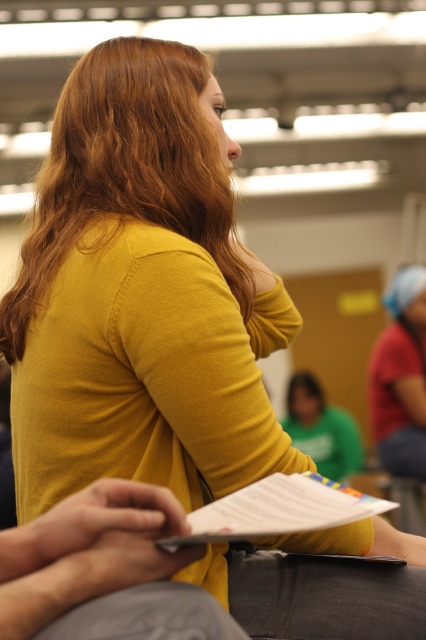
Question: Which object is closer to the camera taking this photo?

Choices:
 (A) golden smooth hair at upper center
 (B) white paper at center

Answer: (B)

Question: Which object appears farthest from the camera in this image?

Choices:
 (A) white paper at center
 (B) golden smooth hair at upper center

Answer: (B)

Question: Is golden smooth hair at upper center closer to the viewer compared to white paper at center?

Choices:
 (A) yes
 (B) no

Answer: (B)

Question: Can you confirm if golden smooth hair at upper center is positioned above white paper at center?

Choices:
 (A) no
 (B) yes

Answer: (B)

Question: Can you confirm if golden smooth hair at upper center is wider than white paper at center?

Choices:
 (A) yes
 (B) no

Answer: (A)